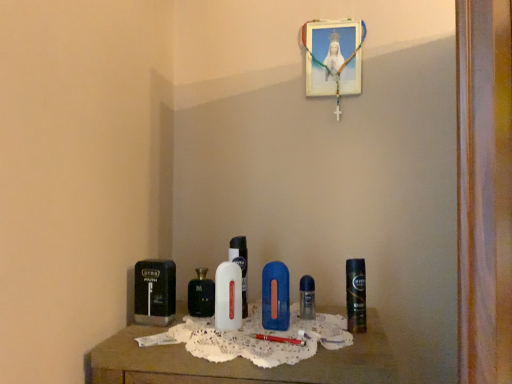
Identify the location of free spot to the right of black plastic razor at left, which is the 3th personal care from right to left. This screenshot has width=512, height=384. (205, 328).